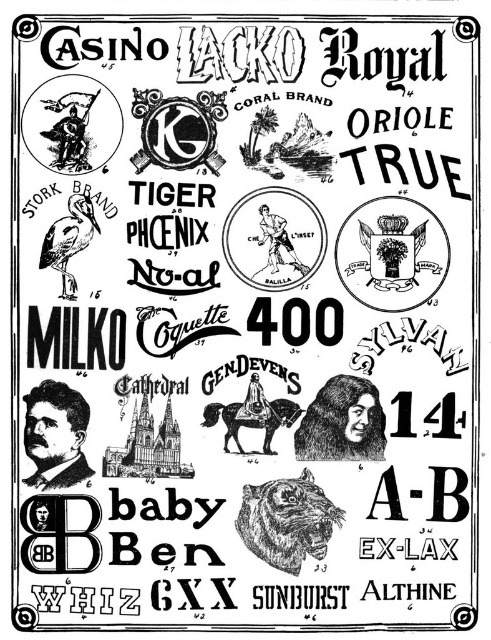
Which is below, brown textured tiger head at center or brown leather horse at center?

brown textured tiger head at center is below.

Between brown textured tiger head at center and brown leather horse at center, which one is positioned higher?

brown leather horse at center is higher up.

Describe the element at coordinates (287, 520) in the screenshot. The height and width of the screenshot is (640, 491). I see `brown textured tiger head at center` at that location.

The image size is (491, 640). I want to click on brown textured tiger head at center, so click(x=287, y=520).

Can you confirm if black matte stork at left is wider than brown leather horse at center?

In fact, black matte stork at left might be narrower than brown leather horse at center.

Can you confirm if black matte stork at left is positioned below brown leather horse at center?

Incorrect, black matte stork at left is not positioned below brown leather horse at center.

Does point (73, 196) lie behind point (235, 428)?

Yes, it is.

Identify the location of black matte stork at left. The image size is (491, 640). (69, 240).

Can you confirm if brown textured tiger head at center is positioned to the right of black ink drawing of a person at center?

Incorrect, brown textured tiger head at center is not on the right side of black ink drawing of a person at center.

Is point (295, 572) closer to viewer compared to point (337, 387)?

No, (295, 572) is further to viewer.

Locate an element on the screen. Image resolution: width=491 pixels, height=640 pixels. brown textured tiger head at center is located at coordinates (287, 520).